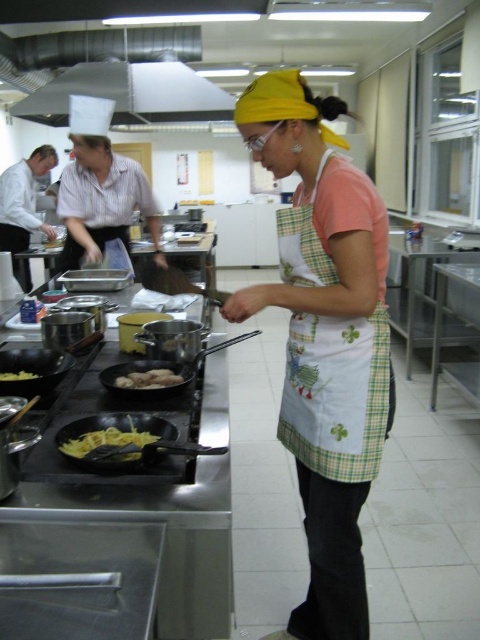
Question: Which object is farther from the camera taking this photo?

Choices:
 (A) green checkered apron at center
 (B) silver metallic frying pan at center
 (C) yellow matte pan at center

Answer: (B)

Question: Which object appears closest to the camera in this image?

Choices:
 (A) silver metallic frying pan at center
 (B) green checkered apron at center
 (C) yellow matte pan at center

Answer: (C)

Question: Is silver metallic frying pan at center wider than yellow matte chicken at center?

Choices:
 (A) yes
 (B) no

Answer: (A)

Question: Is white apron at center above green checkered apron at center?

Choices:
 (A) yes
 (B) no

Answer: (B)

Question: Is white apron at center smaller than yellow matte food at lower left?

Choices:
 (A) no
 (B) yes

Answer: (A)

Question: Which object appears closest to the camera in this image?

Choices:
 (A) green checkered apron at center
 (B) white matte exhaust hood at upper center

Answer: (A)